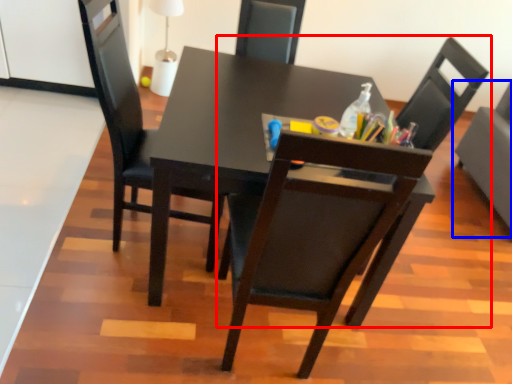
Question: Among these objects, which one is nearest to the camera, chair (highlighted by a red box) or chair (highlighted by a blue box)?

Choices:
 (A) chair
 (B) chair

Answer: (A)